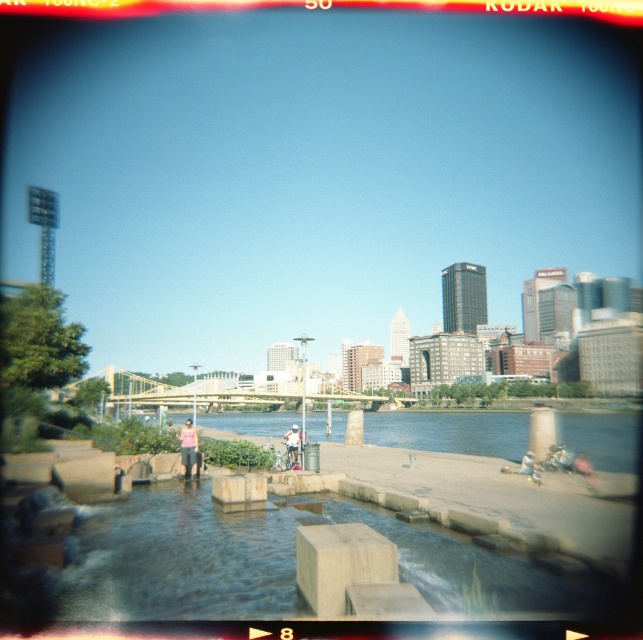
Who is more forward, (341,502) or (512,449)?

Point (341,502) is in front.

Measure the distance between point (221,552) and camera.

Point (221,552) and camera are 40.29 meters apart.

This screenshot has height=640, width=643. I want to click on smooth concrete river at center, so click(285, 563).

Can you confirm if smooth concrete river at center is thinner than pink fabric person at center?

No.

Image resolution: width=643 pixels, height=640 pixels. Describe the element at coordinates (285, 563) in the screenshot. I see `smooth concrete river at center` at that location.

The height and width of the screenshot is (640, 643). I want to click on smooth concrete river at center, so click(285, 563).

Is smooth concrete river at center to the right of white cotton shirt at center from the viewer's perspective?

Indeed, smooth concrete river at center is positioned on the right side of white cotton shirt at center.

Does point (448, 547) lie in front of point (294, 451)?

Yes, it is.

The height and width of the screenshot is (640, 643). Identify the location of smooth concrete river at center. [x=285, y=563].